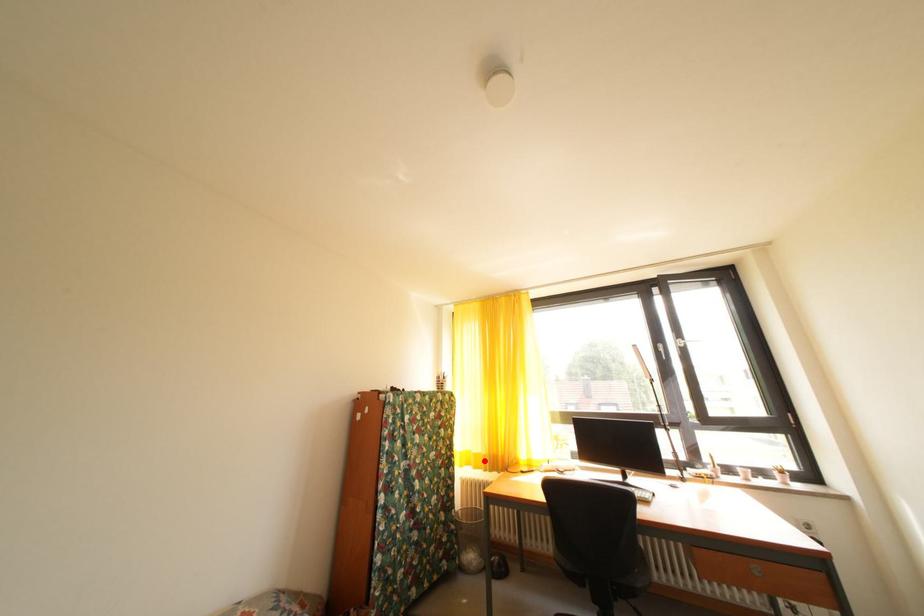
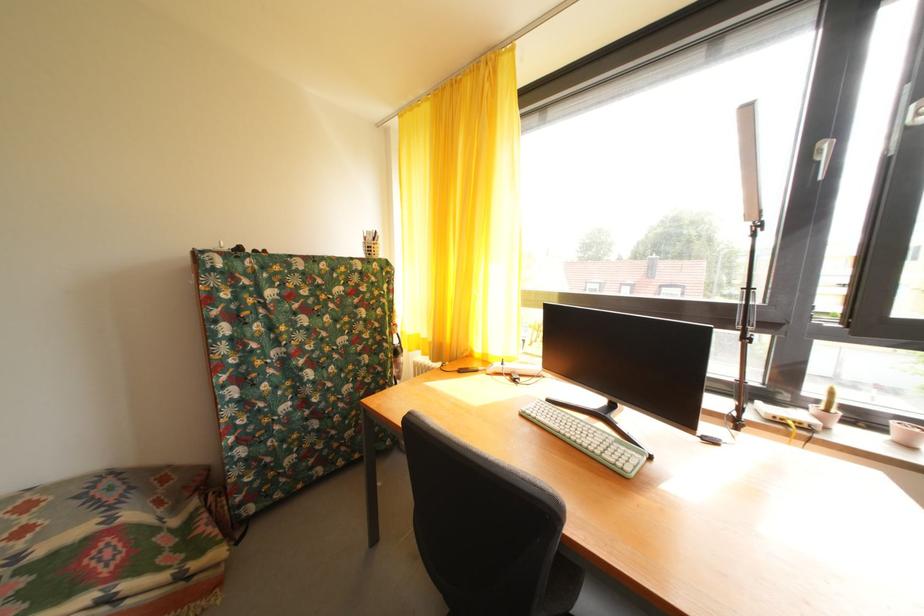
Where in the second image is the point corresponding to the highlighted location from the first image?

(432, 346)